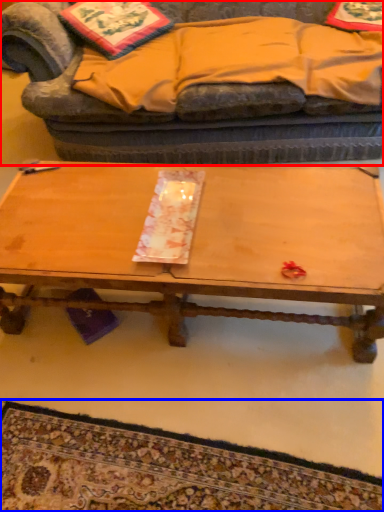
Question: Among these objects, which one is farthest to the camera, studio couch (highlighted by a red box) or mat (highlighted by a blue box)?

Choices:
 (A) studio couch
 (B) mat

Answer: (A)